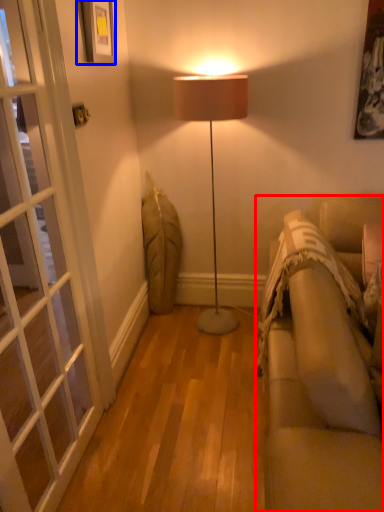
Question: Which object is closer to the camera taking this photo, studio couch (highlighted by a red box) or picture frame (highlighted by a blue box)?

Choices:
 (A) studio couch
 (B) picture frame

Answer: (A)